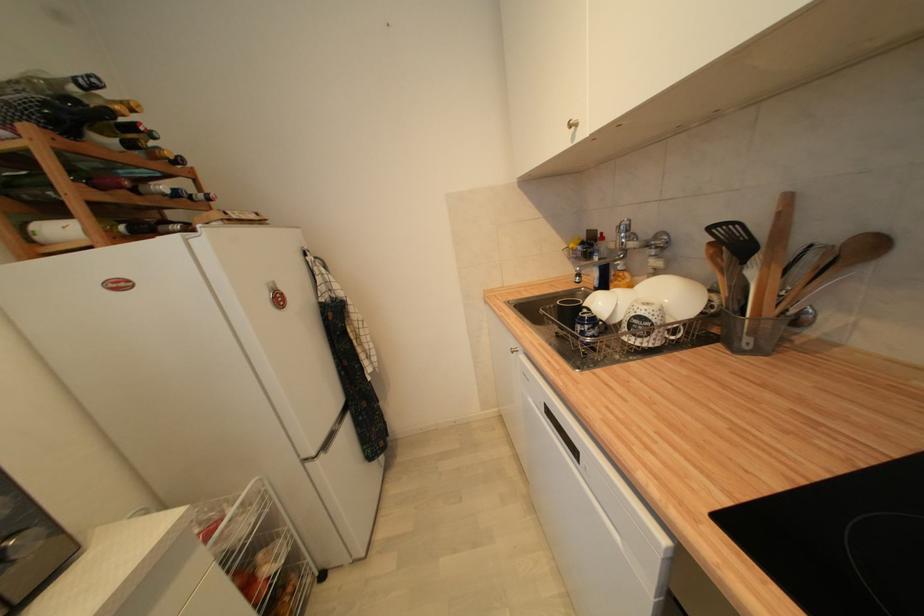
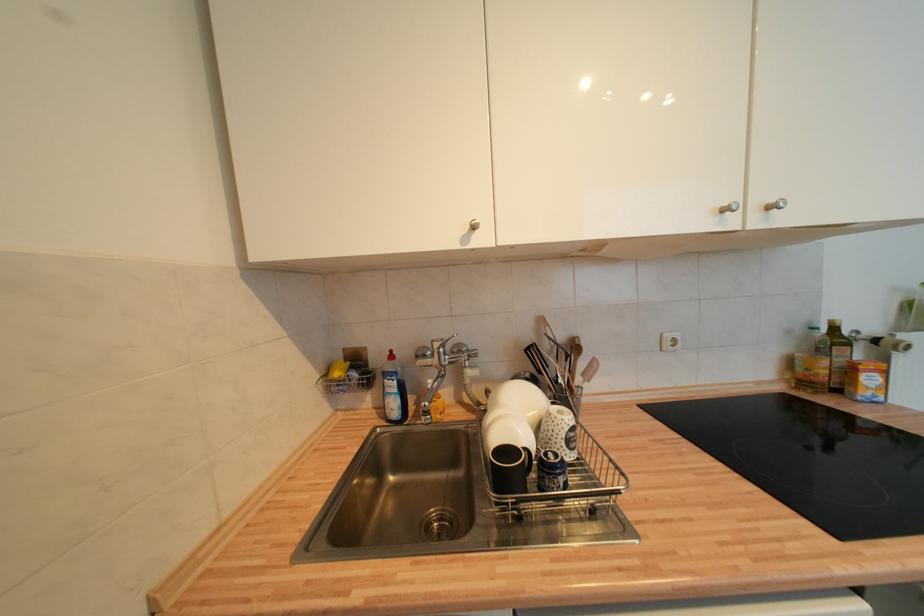
Question: The camera is either moving clockwise (left) or counter-clockwise (right) around the object. The first image is from the beginning of the video and the second image is from the end. Is the camera moving left or right when shooting the video?

Choices:
 (A) Left
 (B) Right

Answer: (A)